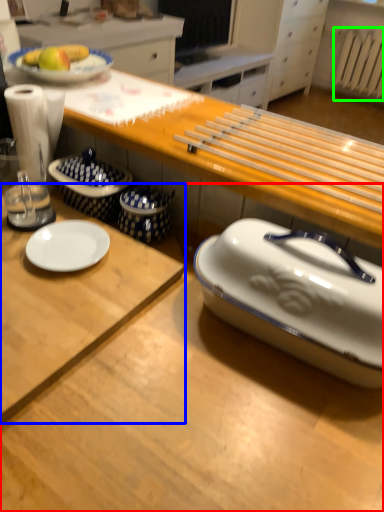
Question: Which object is positioned closest to desk (highlighted by a red box)? Select from desk (highlighted by a blue box) and radiator (highlighted by a green box).

Choices:
 (A) desk
 (B) radiator

Answer: (A)